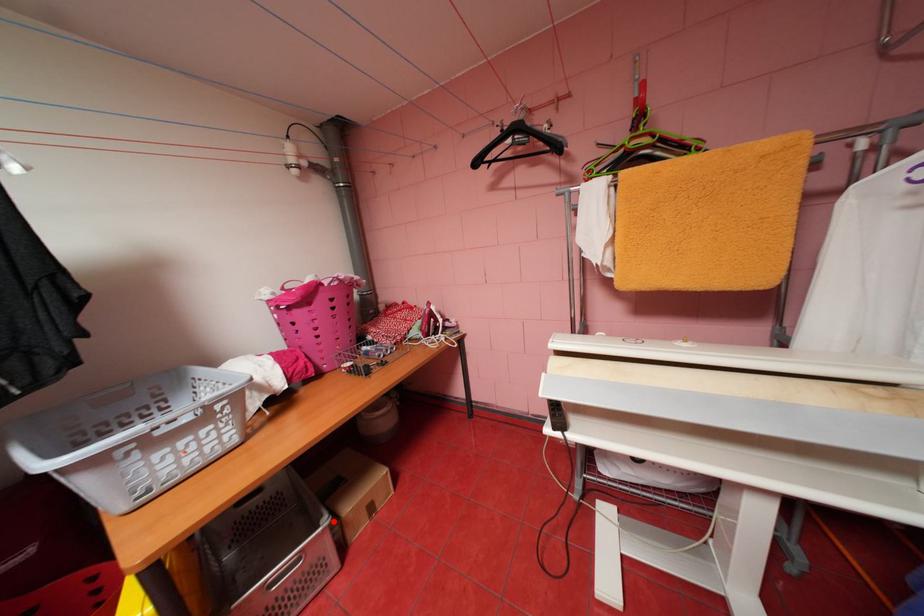
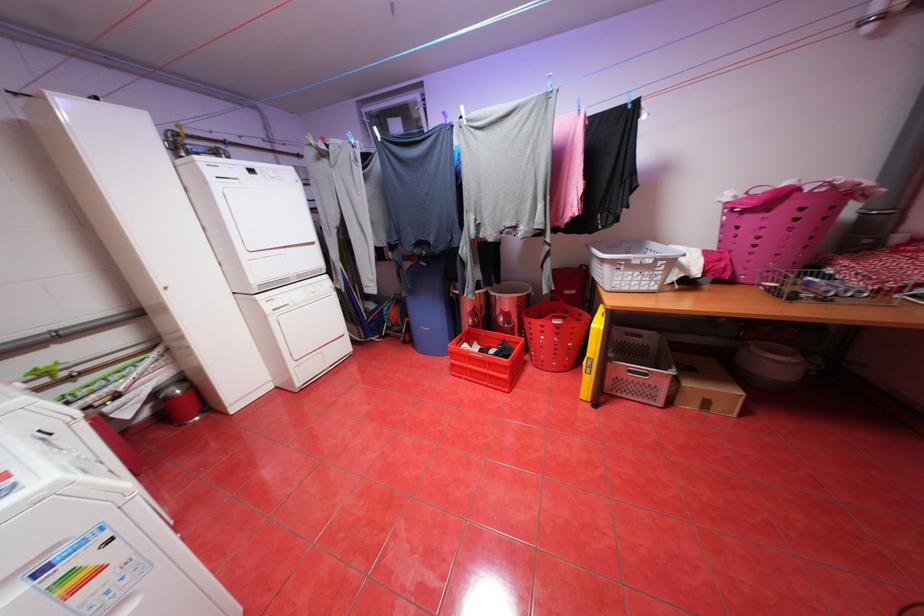
Question: I am providing you with two images of the same scene from different viewpoints. In image1, a red point is highlighted. Considering the same 3D point in image2, which of the following is correct?

Choices:
 (A) It is closer
 (B) It is farther

Answer: (B)